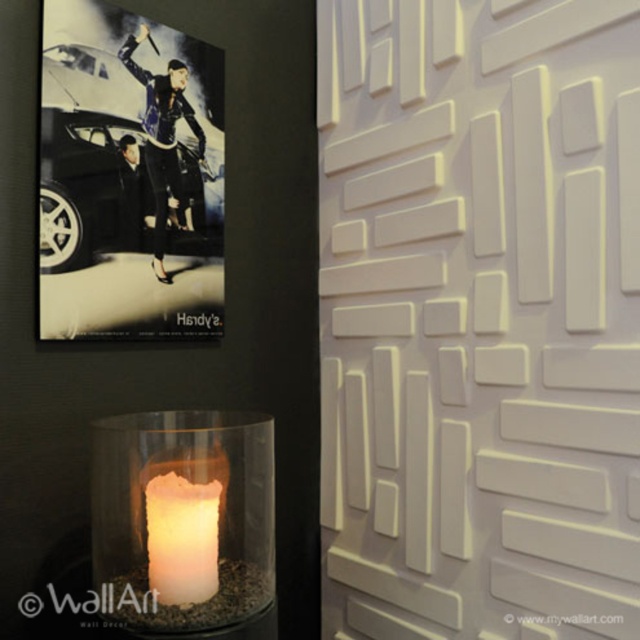
Question: Estimate the real-world distances between objects in this image. Which object is farther from the ivory matte candle at lower left?

Choices:
 (A) black glossy car at upper left
 (B) metallic poster at upper left

Answer: (B)

Question: Is metallic poster at upper left bigger than black glossy car at upper left?

Choices:
 (A) no
 (B) yes

Answer: (B)

Question: Does transparent glass candle at lower left have a larger size compared to black glossy car at upper left?

Choices:
 (A) no
 (B) yes

Answer: (B)

Question: Does metallic poster at upper left have a greater width compared to transparent glass candle at lower left?

Choices:
 (A) no
 (B) yes

Answer: (A)

Question: Among these points, which one is nearest to the camera?

Choices:
 (A) (84, 83)
 (B) (96, 161)
 (C) (132, 460)
 (D) (161, 512)

Answer: (D)

Question: Which point is farther to the camera?

Choices:
 (A) transparent glass candle at lower left
 (B) metallic poster at upper left

Answer: (B)